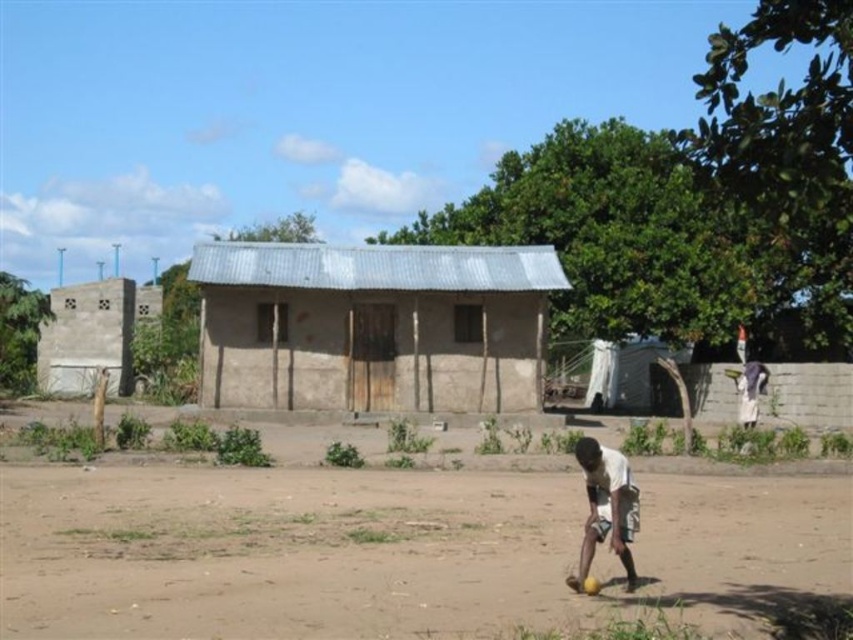
Question: Which point is closer to the camera?

Choices:
 (A) (45, 387)
 (B) (544, 292)
 (C) (612, 506)

Answer: (C)

Question: Does brown mud hut at center appear on the left side of white matte shirt at lower center?

Choices:
 (A) yes
 (B) no

Answer: (A)

Question: Which of the following is the farthest from the observer?

Choices:
 (A) (462, 531)
 (B) (628, 577)
 (C) (537, 323)
 (D) (76, 374)

Answer: (D)

Question: Is brown sandy dirt field at lower center above gray concrete wall at left?

Choices:
 (A) yes
 (B) no

Answer: (B)

Question: Which object is the closest to the gray concrete wall at left?

Choices:
 (A) white matte shirt at lower center
 (B) brown mud hut at center

Answer: (B)

Question: Is gray concrete wall at left to the left of white matte shirt at lower center from the viewer's perspective?

Choices:
 (A) yes
 (B) no

Answer: (A)